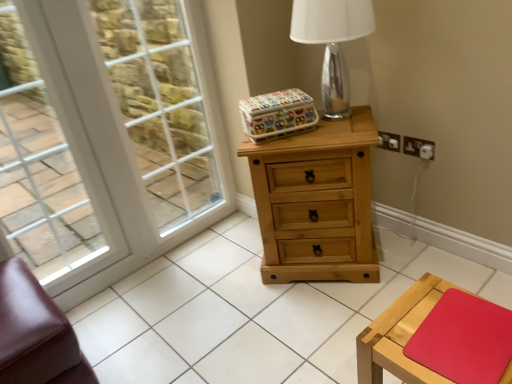
Find the location of a particular element. free space to the left of natural wood chest of drawers at center is located at coordinates pos(229,274).